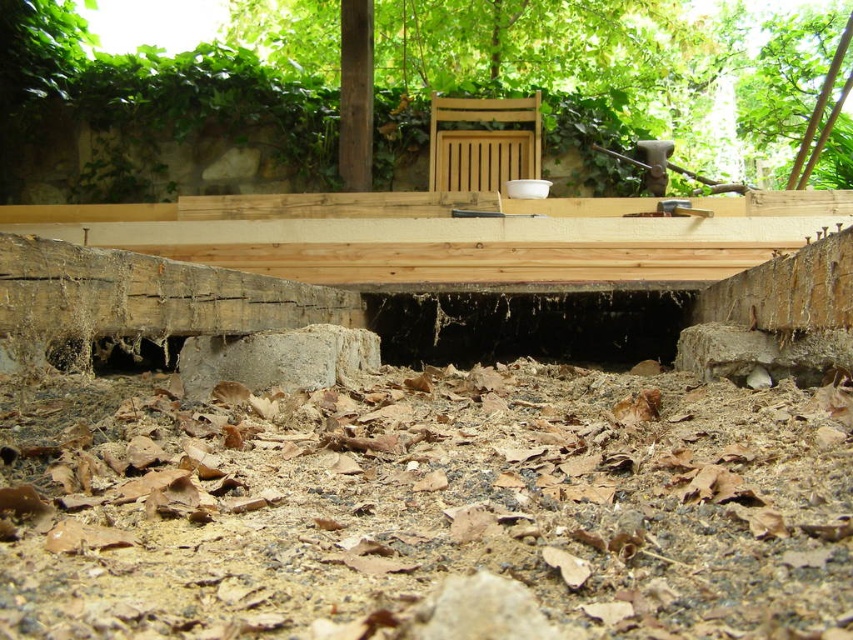
Question: Does brown dirt at center have a smaller size compared to natural wood deck at center?

Choices:
 (A) no
 (B) yes

Answer: (B)

Question: Does brown dirt at center lie behind wooden chair at center?

Choices:
 (A) yes
 (B) no

Answer: (B)

Question: Based on their relative distances, which object is nearer to the brown dirt at center?

Choices:
 (A) natural wood deck at center
 (B) wooden chair at center

Answer: (A)

Question: Which of the following is the closest to the observer?

Choices:
 (A) natural wood deck at center
 (B) wooden chair at center

Answer: (A)

Question: Where is natural wood deck at center located in relation to wooden chair at center in the image?

Choices:
 (A) above
 (B) below

Answer: (B)

Question: Considering the real-world distances, which object is farthest from the natural wood deck at center?

Choices:
 (A) wooden chair at center
 (B) brown dirt at center

Answer: (B)